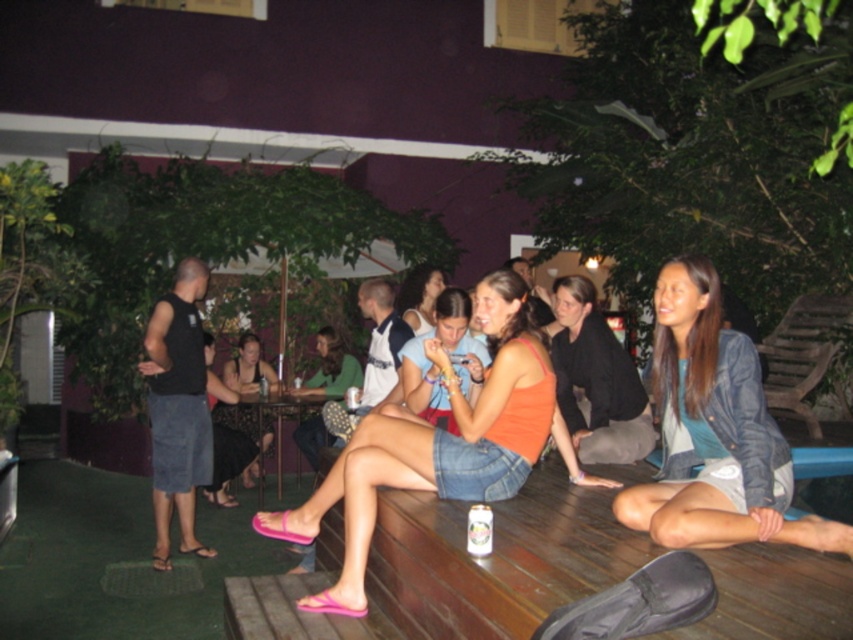
You are a photographer at the event and need to capture a photo of both the black satin dress at center and the metallic can at center. Since the dress is taller than the can, where should you position your camera to ensure both are fully visible in the frame?

Position the camera at a lower angle so that the taller black satin dress at center is captured without blocking the shorter metallic can at center, ensuring both are fully visible in the frame.

You are standing at the entrance of the gathering area and want to reach the denim jacket at lower right. Is the wooden at center blocking your path?

The wooden at center is in front of the denim jacket at lower right, so it is blocking the path to the denim jacket at lower right.